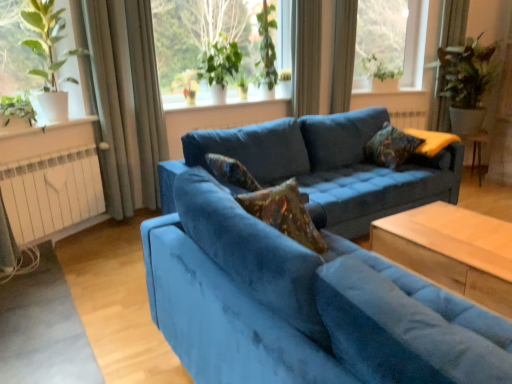
What is the approximate width of velvet blue couch at center, the first studio couch viewed from the back?

velvet blue couch at center, the first studio couch viewed from the back, is 38.81 inches wide.

Locate an element on the screen. The height and width of the screenshot is (384, 512). transparent glass window at upper right, the 3th window viewed from the front is located at coordinates tap(392, 39).

This screenshot has height=384, width=512. What do you see at coordinates (17, 108) in the screenshot? I see `green leafy plant at left, the fifth plant positioned from the right` at bounding box center [17, 108].

Describe the element at coordinates (303, 305) in the screenshot. I see `velvet blue couch at center, the first studio couch in the front-to-back sequence` at that location.

In order to face white ceramic window sill at center, arranged as the 2th window sill when ordered from the bottom, should I rotate leftwards or rightwards?

It's best to rotate left around 2.845 degrees.

The width and height of the screenshot is (512, 384). Identify the location of velvet blue couch at center, the first studio couch viewed from the back. pyautogui.click(x=325, y=167).

From the image's perspective, is green leafy plant at upper left, positioned as the 1th window in left-to-right order, above or below velvet blue couch at center, the first studio couch in the front-to-back sequence?

Clearly, from the image's perspective, green leafy plant at upper left, positioned as the 1th window in left-to-right order, is above velvet blue couch at center, the first studio couch in the front-to-back sequence.

Can you see green leafy plant at upper left, which appears as the 3th window when viewed from the back, touching velvet blue couch at center, the first studio couch in the front-to-back sequence?

green leafy plant at upper left, which appears as the 3th window when viewed from the back, and velvet blue couch at center, the first studio couch in the front-to-back sequence, are clearly separated.

At what (x,y) coordinates should I click in order to perform the action: click on the 2nd studio couch in front of the green leafy plant at upper left, positioned as the 1th window in left-to-right order. Please return your answer as a coordinate pair (x, y). Looking at the image, I should click on (303, 305).

Can you confirm if green leafy plant at upper left, positioned as the 1th window in left-to-right order, is positioned to the right of velvet blue couch at center, positioned as the second studio couch in back-to-front order?

No, green leafy plant at upper left, positioned as the 1th window in left-to-right order, is not to the right of velvet blue couch at center, positioned as the second studio couch in back-to-front order.

From the picture: Looking at the image, does satin curtain at upper center, the first curtain when ordered from right to left, seem bigger or smaller compared to velvet-patterned pillow at center, placed as the 3th pillow when sorted from right to left?

satin curtain at upper center, the first curtain when ordered from right to left, is bigger than velvet-patterned pillow at center, placed as the 3th pillow when sorted from right to left.

Considering the sizes of objects satin curtain at upper center, the first curtain when ordered from right to left, and velvet-patterned pillow at center, which is the 2th pillow from back to front, in the image provided, who is shorter, satin curtain at upper center, the first curtain when ordered from right to left, or velvet-patterned pillow at center, which is the 2th pillow from back to front,?

velvet-patterned pillow at center, which is the 2th pillow from back to front.

Is satin curtain at upper center, which is the 4th curtain in left-to-right order, not close to velvet-patterned pillow at center, which appears as the 1th pillow when viewed from the left?

Yes.

Who is more distant, satin curtain at upper center, the first curtain when ordered from right to left, or velvet-patterned pillow at center, placed as the 3th pillow when sorted from right to left?

satin curtain at upper center, the first curtain when ordered from right to left, is further away from the camera.

Does transparent glass window at upper right, which appears as the 3th window when viewed from the left, turn towards velvet-patterned pillow at center, which appears as the 1th pillow when viewed from the left?

No, transparent glass window at upper right, which appears as the 3th window when viewed from the left, is not turned towards velvet-patterned pillow at center, which appears as the 1th pillow when viewed from the left.

Measure the distance between transparent glass window at upper right, which is the 1th window from back to front, and velvet-patterned pillow at center, the 2th pillow when ordered from front to back.

transparent glass window at upper right, which is the 1th window from back to front, and velvet-patterned pillow at center, the 2th pillow when ordered from front to back, are 3.57 meters apart.

Can you tell me how much transparent glass window at upper right, the 3th window viewed from the front, and velvet-patterned pillow at center, which appears as the 1th pillow when viewed from the left, differ in facing direction?

The facing directions of transparent glass window at upper right, the 3th window viewed from the front, and velvet-patterned pillow at center, which appears as the 1th pillow when viewed from the left, are 119 degrees apart.

Identify the location of the 3rd window directly above the velvet-patterned pillow at center, placed as the 3th pillow when sorted from right to left (from a real-world perspective). (392, 39).

Is gray fabric curtain at left, the 4th curtain when ordered from right to left, beside transparent glass window at upper right, which appears as the 3th window when viewed from the left?

No.

From a real-world perspective, who is located higher, gray fabric curtain at left, the 4th curtain when ordered from right to left, or transparent glass window at upper right, the first window from the right?

transparent glass window at upper right, the first window from the right.

How different are the orientations of gray fabric curtain at left, which is counted as the first curtain, starting from the left, and transparent glass window at upper right, the first window from the right, in degrees?

The angle between the facing direction of gray fabric curtain at left, which is counted as the first curtain, starting from the left, and the facing direction of transparent glass window at upper right, the first window from the right, is 56.4 degrees.

Does gray fabric curtain at left, which is counted as the first curtain, starting from the left, appear on the left side of transparent glass window at upper right, which is the 1th window from back to front?

Indeed, gray fabric curtain at left, which is counted as the first curtain, starting from the left, is positioned on the left side of transparent glass window at upper right, which is the 1th window from back to front.

From the image's perspective, which is above, velvet-patterned pillow at center, the 2th pillow viewed from the right, or light brown wooden table at lower right?

velvet-patterned pillow at center, the 2th pillow viewed from the right.

Considering the sizes of objects velvet-patterned pillow at center, which appears as the 1th pillow when viewed from the front, and light brown wooden table at lower right in the image provided, who is wider, velvet-patterned pillow at center, which appears as the 1th pillow when viewed from the front, or light brown wooden table at lower right?

With larger width is light brown wooden table at lower right.

Can you see velvet-patterned pillow at center, arranged as the 2th pillow when viewed from the left, touching light brown wooden table at lower right?

No, velvet-patterned pillow at center, arranged as the 2th pillow when viewed from the left, is not in contact with light brown wooden table at lower right.

Which object is positioned more to the right, velvet-patterned pillow at center, the 2th pillow viewed from the right, or light brown wooden table at lower right?

light brown wooden table at lower right.

Can you tell me how much green leafy plant at upper left, which ranks as the first window in front-to-back order, and green leafy plant at left, the fifth plant positioned from the right, differ in facing direction?

The facing directions of green leafy plant at upper left, which ranks as the first window in front-to-back order, and green leafy plant at left, the fifth plant positioned from the right, are 0.00061 degrees apart.

From the image's perspective, which is below, green leafy plant at upper left, which ranks as the first window in front-to-back order, or green leafy plant at left, the first plant from the left?

From the image's view, green leafy plant at left, the first plant from the left, is below.

In the scene shown: Is the surface of green leafy plant at upper left, which appears as the 3th window when viewed from the back, in direct contact with green leafy plant at left, the fifth plant positioned from the right?

green leafy plant at upper left, which appears as the 3th window when viewed from the back, and green leafy plant at left, the fifth plant positioned from the right, are clearly separated.

Who is bigger, green leafy plant at upper left, which appears as the 3th window when viewed from the back, or green leafy plant at left, the fifth plant positioned from the right?

green leafy plant at upper left, which appears as the 3th window when viewed from the back.

From a real-world perspective, is green leafy plant at upper left, which ranks as the first window in front-to-back order, positioned under white metallic radiator at lower left based on gravity?

No, from a real-world perspective, green leafy plant at upper left, which ranks as the first window in front-to-back order, is not beneath white metallic radiator at lower left.

Identify the location of radiator that appears below the green leafy plant at upper left, which appears as the 3th window when viewed from the back (from a real-world perspective). (52, 192).

Is green leafy plant at upper left, which appears as the 3th window when viewed from the back, aimed at white metallic radiator at lower left?

No, green leafy plant at upper left, which appears as the 3th window when viewed from the back, is not facing towards white metallic radiator at lower left.

Which is more to the left, green leafy plant at upper left, which is the third window in right-to-left order, or white metallic radiator at lower left?

From the viewer's perspective, green leafy plant at upper left, which is the third window in right-to-left order, appears more on the left side.

Identify the location of the 1st window behind the velvet blue couch at center, positioned as the second studio couch in back-to-front order, starting your count from the anchor. The height and width of the screenshot is (384, 512). (38, 49).

From a real-world perspective, which pillow is the 2nd one underneath the satin curtain at upper center, which is the 4th curtain in left-to-right order? Please provide its 2D coordinates.

[(231, 172)]

In the scene shown: When comparing their distances from green leafy plants at upper center, which is the 2th window from left to right, does green leafy plant at upper center, the fourth plant in the right-to-left sequence, or satin curtain at upper center, which is the 4th curtain in left-to-right order, seem closer?

The object closer to green leafy plants at upper center, which is the 2th window from left to right, is green leafy plant at upper center, the fourth plant in the right-to-left sequence.

Looking at this image, considering their positions, is green leafy plant at upper center, which is counted as the 4th plant, starting from the left, positioned closer to green leafy plant at upper center, the fourth plant in the right-to-left sequence, than transparent glass window at upper right, which is the 1th window from back to front?

Based on the image, green leafy plant at upper center, which is counted as the 4th plant, starting from the left, appears to be nearer to green leafy plant at upper center, the fourth plant in the right-to-left sequence.

Estimate the real-world distances between objects in this image. Which object is closer to velvet floral pillow at right, the 3th pillow from the left, velvet blue couch at center, acting as the second studio couch starting from the front, or satin curtain at upper center, the 2th curtain positioned from the right?

velvet blue couch at center, acting as the second studio couch starting from the front, is closer to velvet floral pillow at right, the 3th pillow from the left.

Considering their positions, is white ceramic window sill at center, acting as the second window sill starting from the front, positioned further to green leafy plant at left, the fifth plant positioned from the right, than green leafy plant at upper center, which appears as the 3th plant when viewed from the right?

Based on the image, green leafy plant at upper center, which appears as the 3th plant when viewed from the right, appears to be further to green leafy plant at left, the fifth plant positioned from the right.

From the image, which object appears to be farther from green leafy plants at upper center, the second window positioned from the right, satin curtain at upper center, which is the 4th curtain in left-to-right order, or velvet floral pillow at right, the 3th pillow from the left?

Based on the image, velvet floral pillow at right, the 3th pillow from the left, appears to be further to green leafy plants at upper center, the second window positioned from the right.

When comparing their distances from velvet-patterned pillow at center, arranged as the 2th pillow when viewed from the left, does white metallic radiator at lower left or velvet floral pillow at right, marked as the first pillow in a right-to-left arrangement, seem closer?

Based on the image, velvet floral pillow at right, marked as the first pillow in a right-to-left arrangement, appears to be nearer to velvet-patterned pillow at center, arranged as the 2th pillow when viewed from the left.

Considering their positions, is gray fabric curtain at left, the 4th curtain when ordered from right to left, positioned closer to green leafy plants at upper center, the second window positioned from the right, than white ceramic window sill at center, which ranks as the 1th window sill in back-to-front order?

The object closer to green leafy plants at upper center, the second window positioned from the right, is white ceramic window sill at center, which ranks as the 1th window sill in back-to-front order.

Considering their positions, is green leafy plant at upper center, which is the 2th plant in left-to-right order, positioned further to velvet blue couch at center, the first studio couch viewed from the back, than velvet blue couch at center, positioned as the second studio couch in back-to-front order?

The object further to velvet blue couch at center, the first studio couch viewed from the back, is green leafy plant at upper center, which is the 2th plant in left-to-right order.

I want to click on radiator located between white ceramic window sill at upper left, the 2th window sill from the right, and green leafy plant at upper center, which is counted as the 4th plant, starting from the left, in the left-right direction, so click(52, 192).

The image size is (512, 384). In order to click on studio couch between velvet-patterned pillow at center, the 2th pillow viewed from the right, and transparent glass window at upper right, which is the 1th window from back to front, along the z-axis in this screenshot , I will do `click(325, 167)`.

I want to click on window between velvet blue couch at center, positioned as the second studio couch in back-to-front order, and white metallic radiator at lower left from front to back, so click(x=38, y=49).

The image size is (512, 384). Identify the location of window sill that lies between green leafy plants at upper center, which is the 2th window from left to right, and beige fabric curtain at left, the 3th curtain in the right-to-left sequence, from top to bottom. (257, 96).